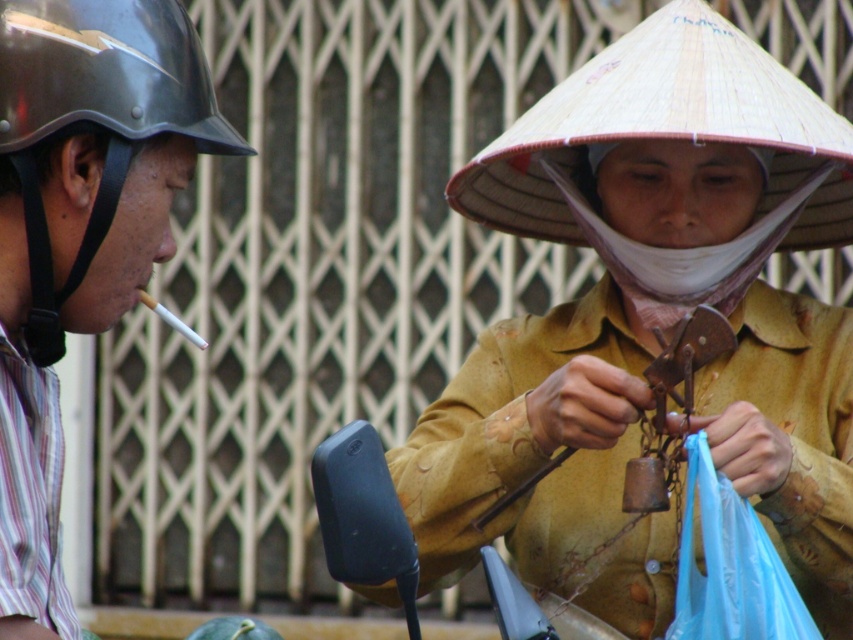
You are standing in the street scene and want to buy a souvenir from the person with the natural straw conical hat at upper right. If you can only throw an object up to 100 feet, can you reach them by throwing a stone?

Answer: The natural straw conical hat at upper right is 117.79 feet away from the viewer. Since you can only throw up to 100 feet, you cannot reach them by throwing a stone.

You are a pedestrian trying to determine which object is bigger between the matte yellow shirt at center and the shiny black helmet at left. Based on the scene, which one has a bigger size?

The matte yellow shirt at center is larger in size than the shiny black helmet at left according to the description.

You are a delivery rider wearing a helmet and need to pass through a narrow alley. The alley is just wide enough for your helmet. If you see the natural straw conical hat at upper right and the shiny black helmet at left in the scene, which object would you need to avoid hitting your helmet on due to its width?

The natural straw conical hat at upper right might be wider than the shiny black helmet at left, so you should avoid hitting it to prevent your helmet from getting stuck.